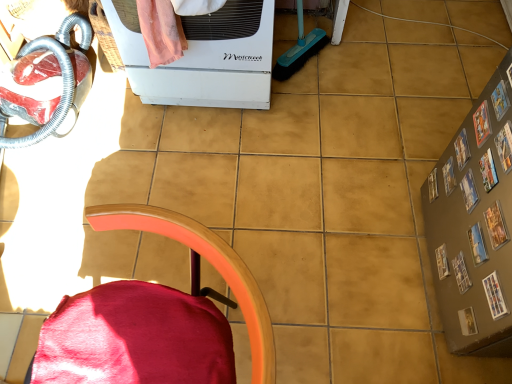
Question: Which is correct: white matte appliance at upper center is inside velvet red chair at lower left, or outside of it?

Choices:
 (A) inside
 (B) outside

Answer: (B)

Question: From their relative heights in the image, would you say white matte appliance at upper center is taller or shorter than velvet red chair at lower left?

Choices:
 (A) short
 (B) tall

Answer: (A)

Question: Is point (194, 87) closer or farther from the camera than point (102, 304)?

Choices:
 (A) farther
 (B) closer

Answer: (A)

Question: Considering the positions of velvet red chair at lower left and white matte appliance at upper center in the image, is velvet red chair at lower left wider or thinner than white matte appliance at upper center?

Choices:
 (A) wide
 (B) thin

Answer: (B)

Question: Is point (202, 316) positioned closer to the camera than point (245, 21)?

Choices:
 (A) closer
 (B) farther

Answer: (A)

Question: Considering the positions of velvet red chair at lower left and white matte appliance at upper center in the image, is velvet red chair at lower left taller or shorter than white matte appliance at upper center?

Choices:
 (A) tall
 (B) short

Answer: (A)

Question: Choose the correct answer: Is velvet red chair at lower left inside white matte appliance at upper center or outside it?

Choices:
 (A) outside
 (B) inside

Answer: (A)